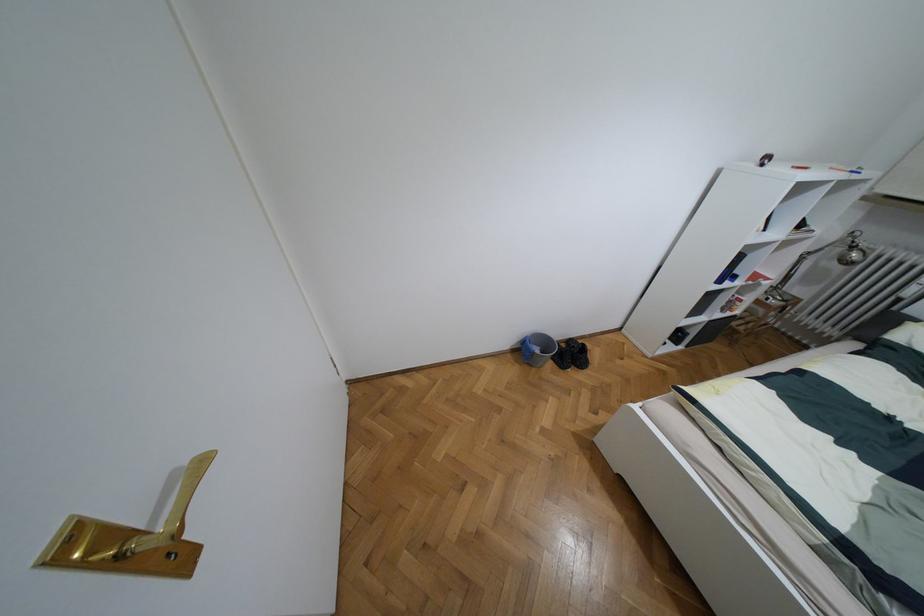
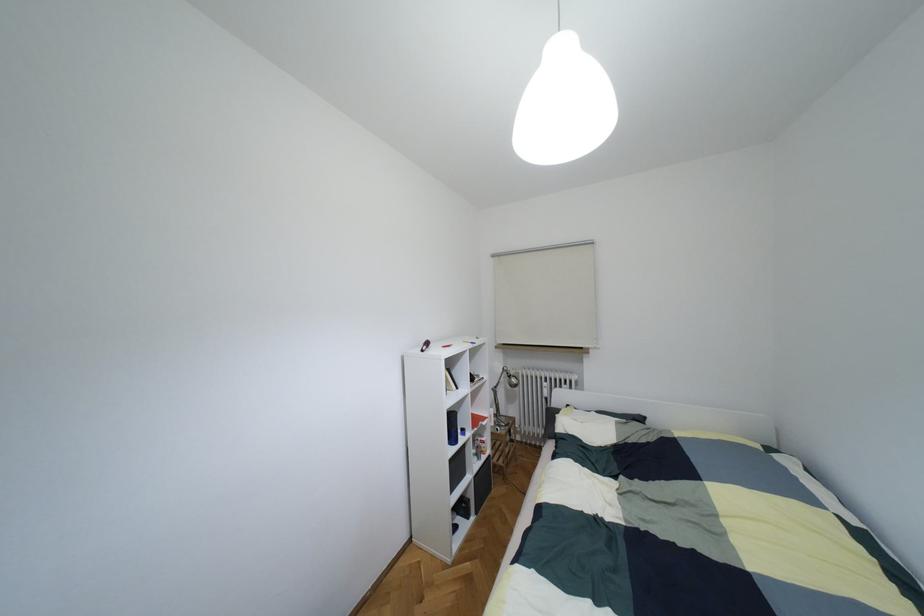
Locate, in the second image, the point that corresponds to pixel 730 328 in the first image.

(493, 464)